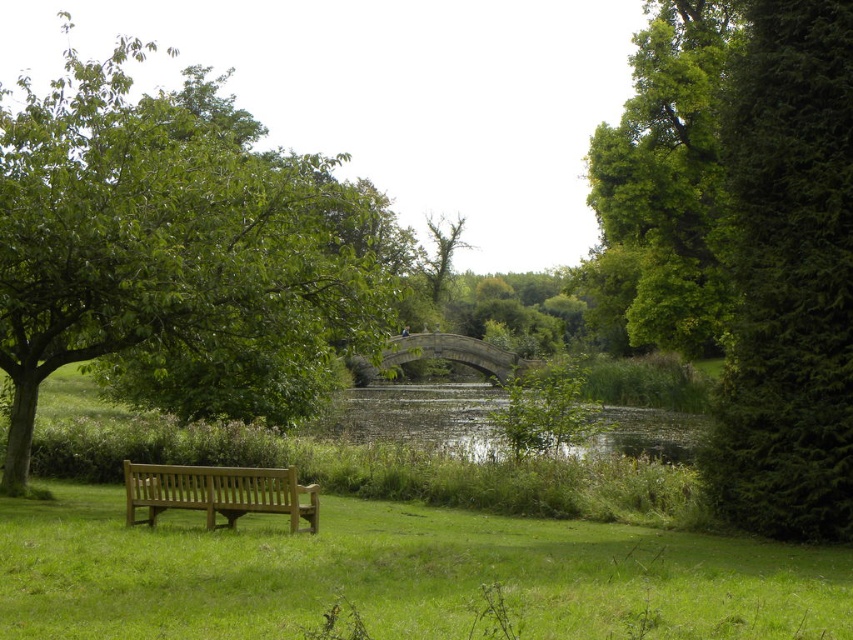
Question: Which point is farther to the camera?

Choices:
 (A) green leafy tree at upper right
 (B) bare wood tree at center
 (C) light brown wooden bench at lower left
 (D) green grass at lower left

Answer: (B)

Question: Does green leafy tree at left appear on the left side of green leafy tree at upper right?

Choices:
 (A) yes
 (B) no

Answer: (A)

Question: Is green grass at lower left to the left of green leafy tree at left from the viewer's perspective?

Choices:
 (A) yes
 (B) no

Answer: (B)

Question: Is green grass at lower left to the right of light brown wooden bench at lower left from the viewer's perspective?

Choices:
 (A) no
 (B) yes

Answer: (B)

Question: Considering the real-world distances, which object is farthest from the green leafy tree at upper right?

Choices:
 (A) bare wood tree at center
 (B) green grass at lower left
 (C) light brown wooden bench at lower left
 (D) green leafy tree at left

Answer: (A)

Question: Estimate the real-world distances between objects in this image. Which object is closer to the green leafy tree at upper right?

Choices:
 (A) green grass at lower left
 (B) green leafy tree at left

Answer: (A)